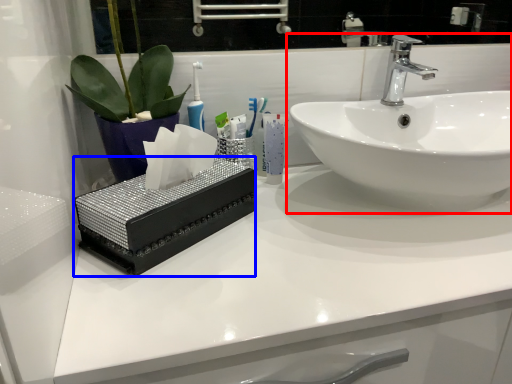
Question: Which point is closer to the camera, sink (highlighted by a red box) or box (highlighted by a blue box)?

Choices:
 (A) sink
 (B) box

Answer: (B)